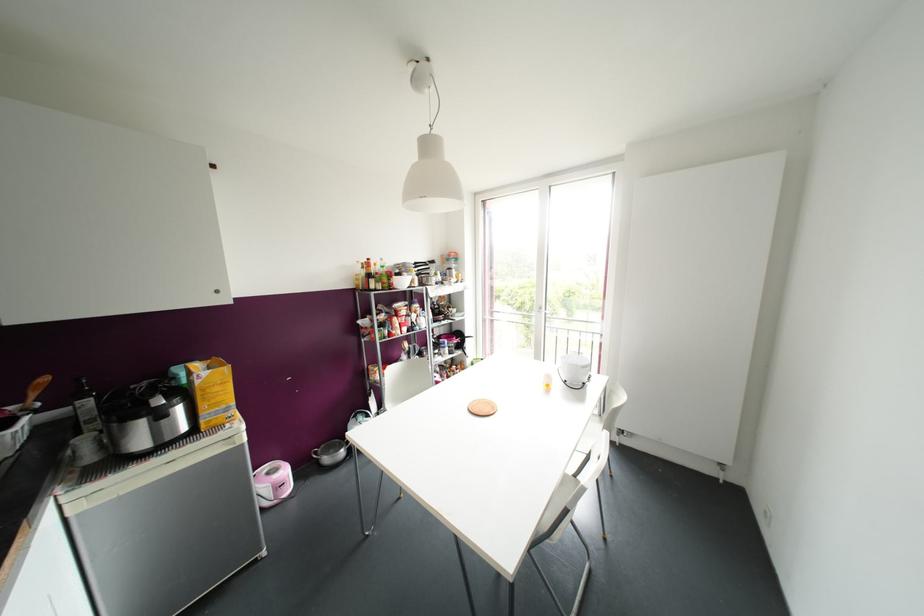
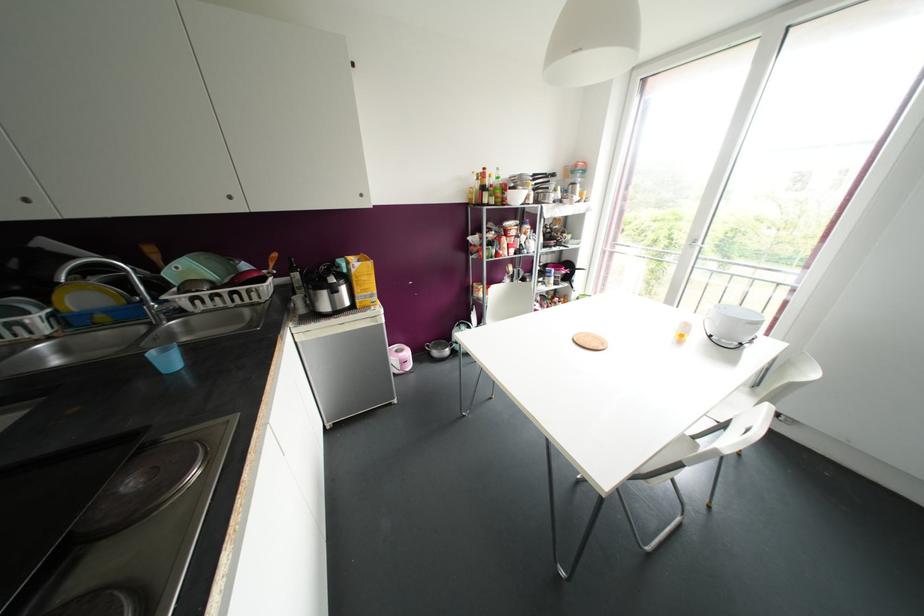
Where in the second image is the point corresponding to (x=215, y=387) from the first image?

(363, 277)